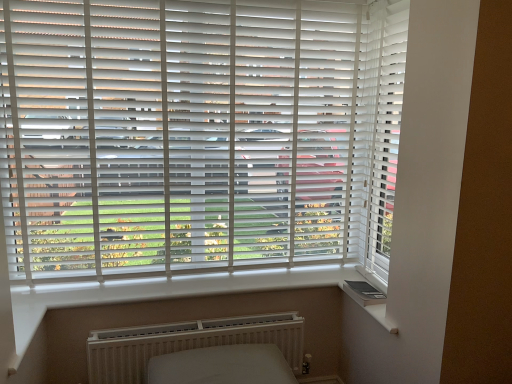
Question: Relative to white smooth window sill at lower right, is white textured radiator at lower center in front or behind?

Choices:
 (A) behind
 (B) front

Answer: (A)

Question: Based on their positions, is white textured radiator at lower center located to the left or right of white smooth window sill at lower right?

Choices:
 (A) right
 (B) left

Answer: (B)

Question: Estimate the real-world distances between objects in this image. Which object is farther from the white smooth window sill at lower right?

Choices:
 (A) white matte blinds at center
 (B) white textured radiator at lower center

Answer: (A)

Question: Which object is the closest to the white textured radiator at lower center?

Choices:
 (A) white matte blinds at center
 (B) white smooth window sill at lower right

Answer: (B)